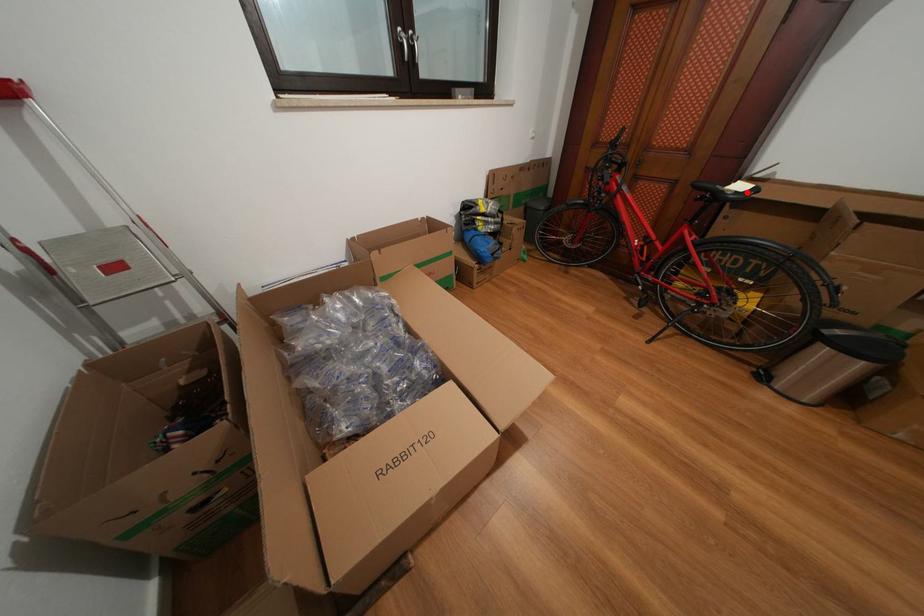
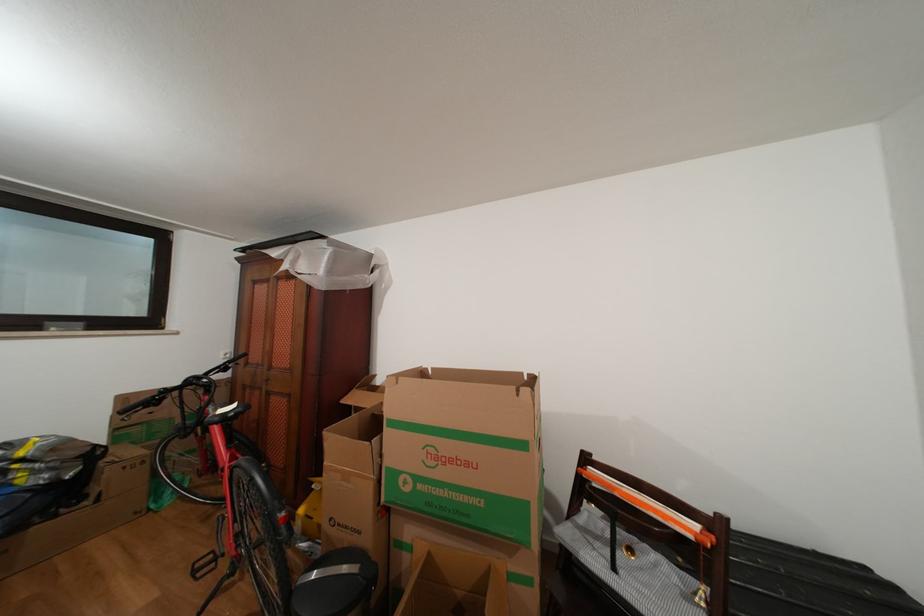
Question: I am providing you with two images of the same scene from different viewpoints. Image1 has a red point marked. In image2, the corresponding 3D location appears at what relative position? Reply with the corresponding letter.

Choices:
 (A) Closer
 (B) Farther

Answer: (A)